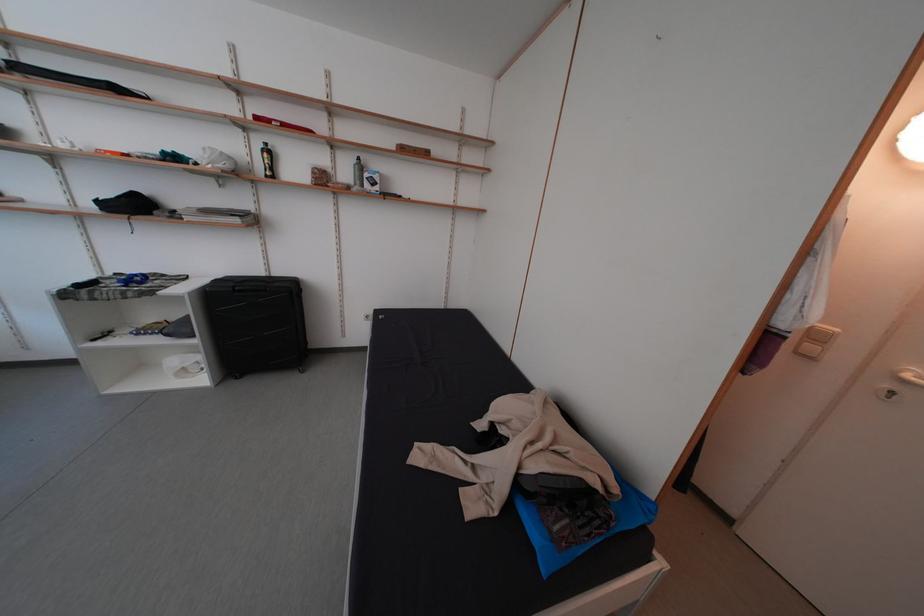
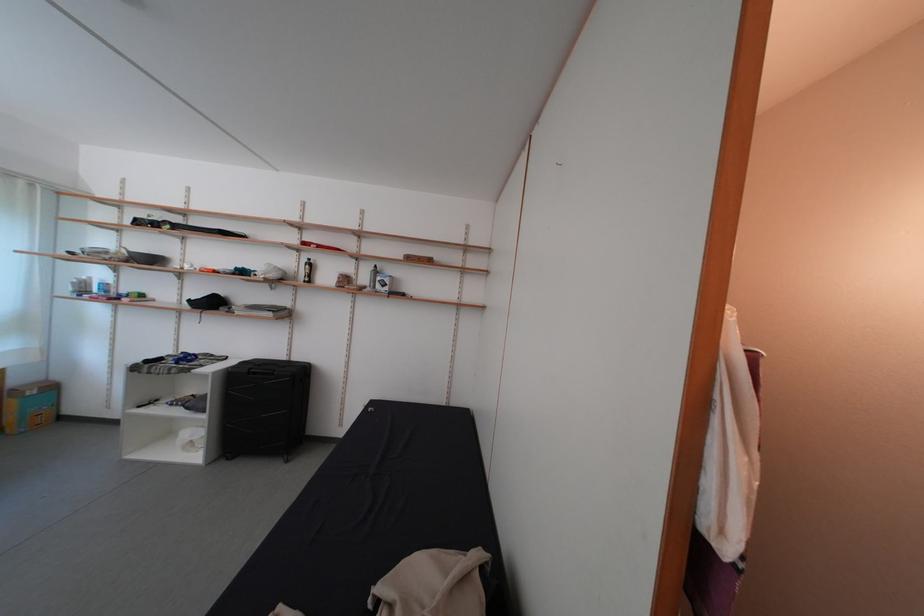
Question: The images are taken continuously from a first-person perspective. In which direction is your viewpoint rotating?

Choices:
 (A) Left
 (B) Right
 (C) Up
 (D) Down

Answer: (C)